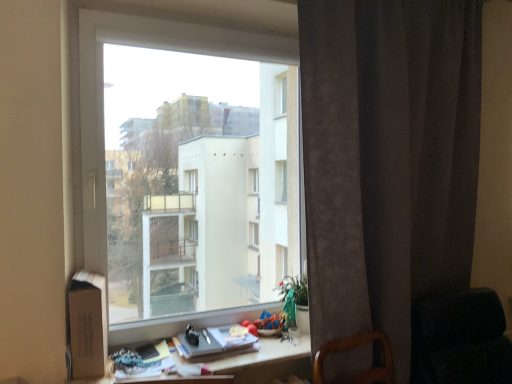
Question: Based on their positions, is wooden desk at center located to the left or right of dark fabric rocking chair at lower right?

Choices:
 (A) right
 (B) left

Answer: (B)

Question: Is point (294, 367) positioned closer to the camera than point (414, 304)?

Choices:
 (A) farther
 (B) closer

Answer: (B)

Question: Which object is the closest to the dark gray velvet curtain at right?

Choices:
 (A) wooden desk at center
 (B) transparent glass window at center
 (C) dark fabric rocking chair at lower right
 (D) matte gray book at lower center

Answer: (C)

Question: Estimate the real-world distances between objects in this image. Which object is closer to the dark fabric rocking chair at lower right?

Choices:
 (A) wooden desk at center
 (B) dark gray velvet curtain at right
 (C) matte gray book at lower center
 (D) transparent glass window at center

Answer: (B)